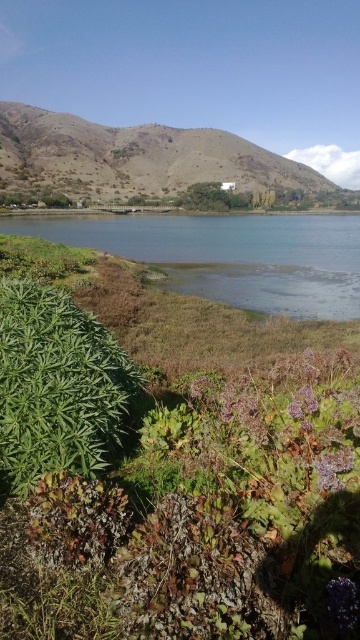
Can you confirm if green leafy plant at lower left is positioned below brown/dry grassy hillside at upper center?

Yes.

Consider the image. Which is above, green leafy plant at lower left or brown/dry grassy hillside at upper center?

brown/dry grassy hillside at upper center is higher up.

Is point (55, 396) farther from viewer compared to point (194, 161)?

No.

This screenshot has width=360, height=640. In order to click on green leafy plant at lower left in this screenshot , I will do `click(57, 385)`.

Is point (209, 140) closer to camera compared to point (326, 605)?

No, (209, 140) is behind (326, 605).

Where is `brown/dry grassy hillside at upper center`? brown/dry grassy hillside at upper center is located at coordinates (136, 157).

Is green leafy plant at lower left behind purple fuzzy flower at lower center?

Yes, green leafy plant at lower left is further from the viewer.

Who is higher up, green leafy plant at lower left or purple fuzzy flower at lower center?

green leafy plant at lower left is above.

Is point (10, 300) closer to camera compared to point (312, 410)?

No, it is behind (312, 410).

Identify the location of green leafy plant at lower left. The height and width of the screenshot is (640, 360). (57, 385).